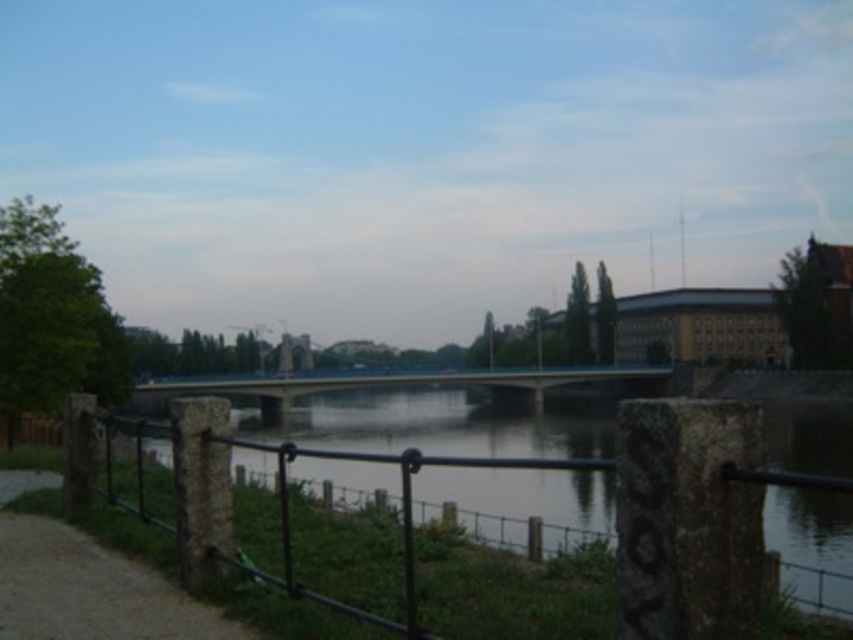
Question: Which point is closer to the camera?

Choices:
 (A) (395, 385)
 (B) (225, 570)

Answer: (B)

Question: Which object is farther from the camera taking this photo?

Choices:
 (A) brown gravel path at lower left
 (B) concrete bridge at center
 (C) black metal fence at center

Answer: (B)

Question: Does black metal fence at center come behind concrete bridge at center?

Choices:
 (A) no
 (B) yes

Answer: (A)

Question: Is black metal fence at center positioned behind brown gravel path at lower left?

Choices:
 (A) no
 (B) yes

Answer: (A)

Question: Does black metal fence at center appear under brown gravel path at lower left?

Choices:
 (A) no
 (B) yes

Answer: (B)

Question: Which is farther from the black metal fence at center?

Choices:
 (A) brown gravel path at lower left
 (B) concrete bridge at center

Answer: (B)